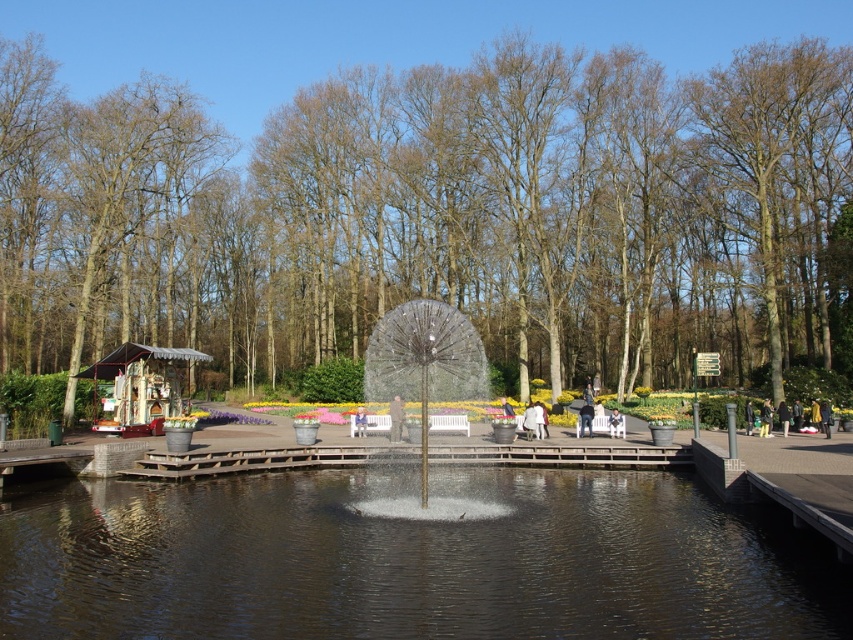
Measure the distance between clear glass sphere at center and camera.

13.41 meters

Is clear glass sphere at center to the left of dark gray jacket at center from the viewer's perspective?

Indeed, clear glass sphere at center is positioned on the left side of dark gray jacket at center.

In order to click on clear glass sphere at center in this screenshot , I will do `click(424, 364)`.

Find the location of `clear glass sphere at center`. clear glass sphere at center is located at coordinates (424, 364).

Is brown leather jacket at center closer to camera compared to white fabric bench at center?

Yes, it is in front of white fabric bench at center.

Is point (402, 420) positioned behind point (619, 417)?

No.

Who is more distant from viewer, (397, 401) or (614, 406)?

Positioned behind is point (614, 406).

The image size is (853, 640). Find the location of `brown leather jacket at center`. brown leather jacket at center is located at coordinates (395, 419).

Does transparent water at center appear under light brown leather jacket at lower right?

Indeed, transparent water at center is positioned under light brown leather jacket at lower right.

What do you see at coordinates (410, 557) in the screenshot?
I see `transparent water at center` at bounding box center [410, 557].

This screenshot has width=853, height=640. Find the location of `transparent water at center`. transparent water at center is located at coordinates (410, 557).